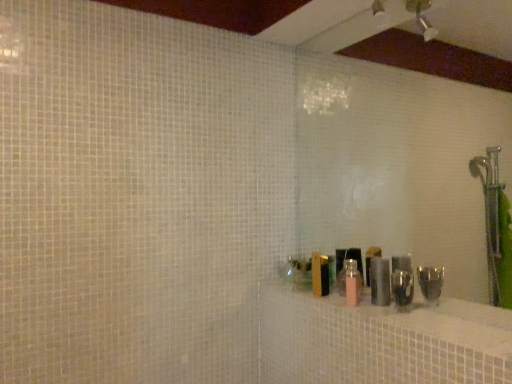
Question: Can you confirm if metallic silver canister at right, the 2th toiletry when ordered from left to right, is positioned to the left of pink matte bottle at center, which is the 1th toiletry from left to right?

Choices:
 (A) no
 (B) yes

Answer: (A)

Question: Is metallic silver canister at right, which is the first toiletry from right to left, closer to the viewer compared to pink matte bottle at center, which is the 1th toiletry from left to right?

Choices:
 (A) no
 (B) yes

Answer: (A)

Question: Does metallic silver canister at right, the 2th toiletry when ordered from left to right, contain pink matte bottle at center, which is the 1th toiletry from left to right?

Choices:
 (A) no
 (B) yes

Answer: (A)

Question: From the image's perspective, is metallic silver canister at right, which is the first toiletry from right to left, below pink matte bottle at center, which is the 1th toiletry from left to right?

Choices:
 (A) yes
 (B) no

Answer: (B)

Question: Are metallic silver canister at right, the 2th toiletry when ordered from left to right, and pink matte bottle at center, which is the 1th toiletry from left to right, far apart?

Choices:
 (A) yes
 (B) no

Answer: (B)

Question: Considering the relative sizes of metallic silver canister at right, which is the first toiletry from right to left, and pink matte bottle at center, which is the 1th toiletry from left to right, in the image provided, is metallic silver canister at right, which is the first toiletry from right to left, taller than pink matte bottle at center, which is the 1th toiletry from left to right,?

Choices:
 (A) no
 (B) yes

Answer: (A)

Question: From the image's perspective, is pink matte bottle at center, which is the 1th toiletry from left to right, on metallic silver canister at right, the 2th toiletry when ordered from left to right?

Choices:
 (A) no
 (B) yes

Answer: (A)

Question: Does pink matte bottle at center, the 2th toiletry from the right, lie in front of metallic silver canister at right, the 2th toiletry when ordered from left to right?

Choices:
 (A) no
 (B) yes

Answer: (B)

Question: Is pink matte bottle at center, the 2th toiletry from the right, at the right side of metallic silver canister at right, which is the first toiletry from right to left?

Choices:
 (A) no
 (B) yes

Answer: (A)

Question: Can you confirm if pink matte bottle at center, the 2th toiletry from the right, is shorter than metallic silver canister at right, which is the first toiletry from right to left?

Choices:
 (A) no
 (B) yes

Answer: (A)

Question: Is pink matte bottle at center, the 2th toiletry from the right, thinner than metallic silver canister at right, which is the first toiletry from right to left?

Choices:
 (A) yes
 (B) no

Answer: (A)

Question: Can you confirm if pink matte bottle at center, which is the 1th toiletry from left to right, is bigger than metallic silver canister at right, the 2th toiletry when ordered from left to right?

Choices:
 (A) yes
 (B) no

Answer: (A)

Question: Is pink matte bottle at center far from metallic silver canister at right, the 2th toiletry when ordered from left to right?

Choices:
 (A) no
 (B) yes

Answer: (A)